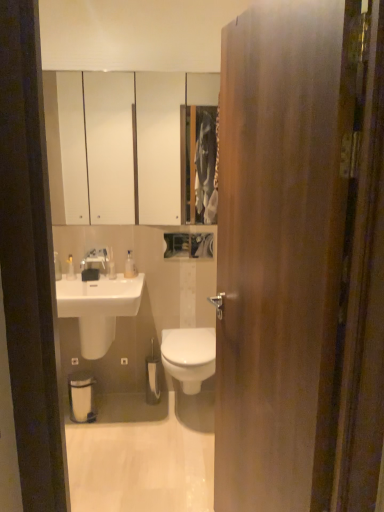
Question: From the image's perspective, relative to translucent plastic bottles at left, the 1th toiletry in the left-to-right sequence, is satin nickel faucet at upper center above or below?

Choices:
 (A) above
 (B) below

Answer: (A)

Question: Is point (87, 264) positioned closer to the camera than point (72, 270)?

Choices:
 (A) closer
 (B) farther

Answer: (A)

Question: Which of these objects is positioned farthest from the clear plastic bottle at upper center, marked as the 1th toiletry in a right-to-left arrangement?

Choices:
 (A) white glossy floor at center
 (B) wooden door at center
 (C) white matte toilet paper at center
 (D) white glossy medicine cabinet at upper center
 (E) white glossy bidet at center

Answer: (D)

Question: Based on their relative distances, which object is nearer to the white matte toilet paper at center?

Choices:
 (A) white glossy floor at center
 (B) translucent plastic bottles at left, the 1th toiletry in the left-to-right sequence
 (C) white glossy sink at lower left
 (D) satin nickel faucet at upper center
 (E) white glossy medicine cabinet at upper center

Answer: (A)